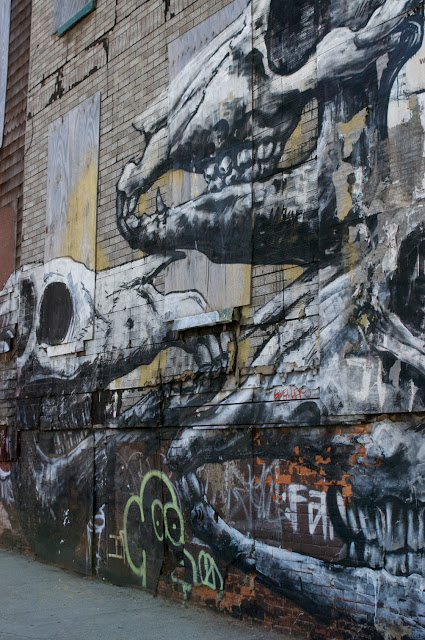
Where is `art`? This screenshot has height=640, width=425. art is located at coordinates (87, 340).